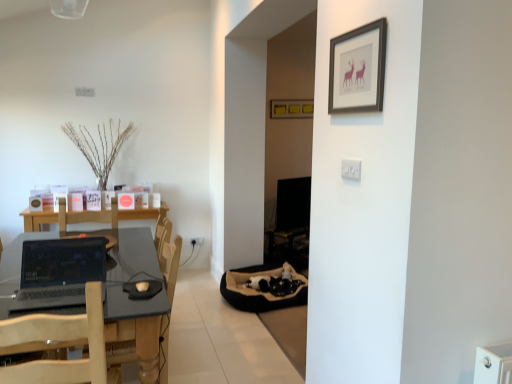
Question: Is wooden armchair at center aimed at dark gray laminate table at left?

Choices:
 (A) yes
 (B) no

Answer: (A)

Question: From the image's perspective, is wooden armchair at center above dark gray laminate table at left?

Choices:
 (A) yes
 (B) no

Answer: (A)

Question: Considering the relative sizes of wooden armchair at center and dark gray laminate table at left in the image provided, is wooden armchair at center smaller than dark gray laminate table at left?

Choices:
 (A) no
 (B) yes

Answer: (B)

Question: Considering the relative positions of wooden armchair at center and dark gray laminate table at left in the image provided, is wooden armchair at center to the right of dark gray laminate table at left from the viewer's perspective?

Choices:
 (A) no
 (B) yes

Answer: (B)

Question: Is wooden armchair at center wider than dark gray laminate table at left?

Choices:
 (A) yes
 (B) no

Answer: (B)

Question: From the image's perspective, is white plastic electric outlet at upper center, marked as the 2th electric outlet in a bottom-to-top arrangement, positioned above or below white plastic electric outlet at center, arranged as the second electric outlet when viewed from the front?

Choices:
 (A) above
 (B) below

Answer: (A)

Question: Is white plastic electric outlet at upper center, placed as the second electric outlet when sorted from left to right, situated inside white plastic electric outlet at center, placed as the 1th electric outlet when sorted from bottom to top, or outside?

Choices:
 (A) outside
 (B) inside

Answer: (A)

Question: From a real-world perspective, relative to white plastic electric outlet at center, acting as the 2th electric outlet starting from the top, is white plastic electric outlet at upper center, placed as the second electric outlet when sorted from left to right, vertically above or below?

Choices:
 (A) above
 (B) below

Answer: (A)

Question: Is white plastic electric outlet at upper center, which ranks as the second electric outlet in back-to-front order, to the left or to the right of white plastic electric outlet at center, placed as the 1th electric outlet when sorted from bottom to top, in the image?

Choices:
 (A) left
 (B) right

Answer: (B)

Question: From a real-world perspective, relative to white plastic electric outlet at center, placed as the 1th electric outlet when sorted from bottom to top, is wooden chair at left vertically above or below?

Choices:
 (A) above
 (B) below

Answer: (A)

Question: From the image's perspective, is wooden chair at left above or below white plastic electric outlet at center, acting as the 2th electric outlet starting from the top?

Choices:
 (A) below
 (B) above

Answer: (A)

Question: In terms of size, does wooden chair at left appear bigger or smaller than white plastic electric outlet at center, acting as the 2th electric outlet starting from the top?

Choices:
 (A) small
 (B) big

Answer: (B)

Question: In terms of width, does wooden chair at left look wider or thinner when compared to white plastic electric outlet at center, placed as the 1th electric outlet when sorted from bottom to top?

Choices:
 (A) wide
 (B) thin

Answer: (A)

Question: Is white plastic electric outlet at center, which is the second electric outlet in right-to-left order, to the left or to the right of matte yellow picture frame at center, acting as the first picture frame starting from the back, in the image?

Choices:
 (A) left
 (B) right

Answer: (A)

Question: From a real-world perspective, is white plastic electric outlet at center, the 1th electric outlet when ordered from left to right, physically located above or below matte yellow picture frame at center, acting as the first picture frame starting from the back?

Choices:
 (A) above
 (B) below

Answer: (B)